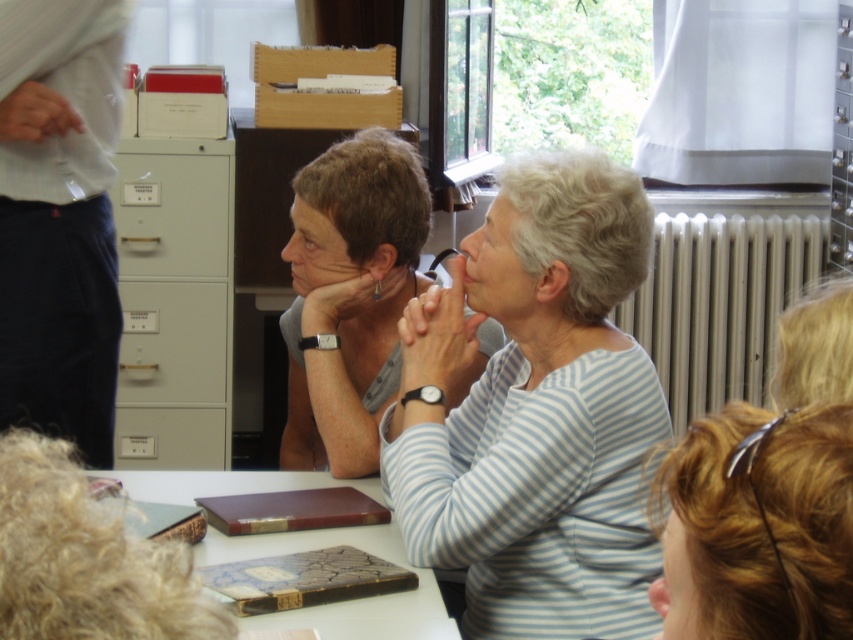
Is point (358, 275) closer to viewer compared to point (242, 627)?

No, (358, 275) is behind (242, 627).

You are a GUI agent. You are given a task and a screenshot of the screen. Output one action in this format:
    pyautogui.click(x=<x>, y=<y>)
    Task: Click on the matte gray shirt at center
    
    Given the screenshot: What is the action you would take?
    pyautogui.click(x=351, y=300)

Is point (350, 540) positioned in front of point (172, 241)?

Yes.

Between brown leather book at center and gray matte file cabinet at left, which one has less height?

brown leather book at center is shorter.

Identify the location of brown leather book at center. (345, 600).

Locate an element on the screen. The height and width of the screenshot is (640, 853). brown leather book at center is located at coordinates (345, 600).

At what (x,y) coordinates should I click in order to perform the action: click on matte gray file cabinet at left. Please return your answer as a coordinate pair (x, y). Image resolution: width=853 pixels, height=640 pixels. Looking at the image, I should click on (173, 301).

This screenshot has height=640, width=853. Find the location of `matte gray file cabinet at left`. matte gray file cabinet at left is located at coordinates (173, 301).